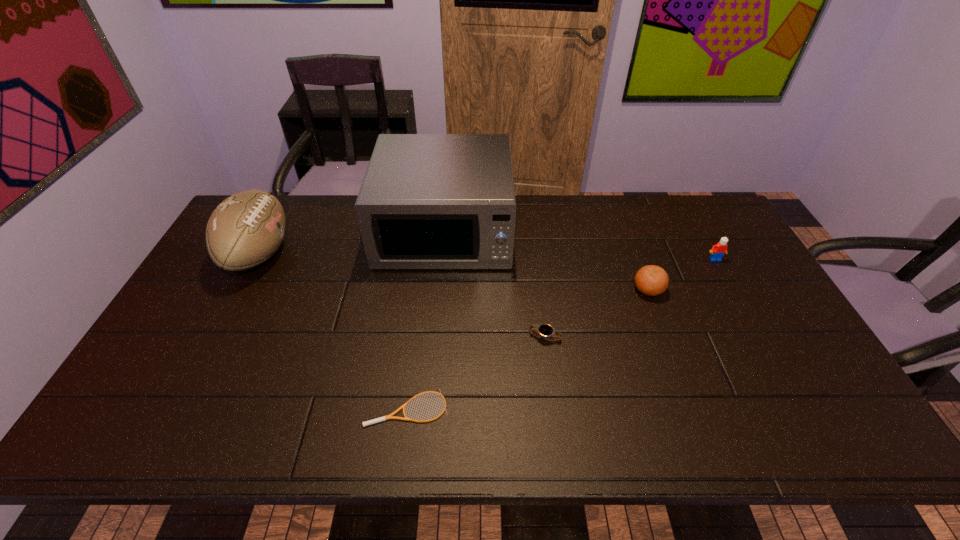
Identify the location of free spot that satisfies the following two spatial constraints: 1. on the laces of the football (American); 2. on the left side of the tennis racket. 178,408.

The width and height of the screenshot is (960, 540). What are the coordinates of `vacant position in the image that satisfies the following two spatial constraints: 1. on the laces of the nearest object; 2. on the right side of the second tallest object` in the screenshot? It's located at (178, 408).

At what (x,y) coordinates should I click in order to perform the action: click on free space that satisfies the following two spatial constraints: 1. with the door open on the microwave oven; 2. on the left side of the fourth object from left to right. Please return your answer as a coordinate pair (x, y). The width and height of the screenshot is (960, 540). Looking at the image, I should click on (435, 337).

In order to click on free space that satisfies the following two spatial constraints: 1. with the door open on the microwave oven; 2. on the right side of the clementine in this screenshot , I will do `click(439, 289)`.

Identify the location of vacant space that satisfies the following two spatial constraints: 1. on the laces of the fourth object from left to right; 2. on the left side of the second tallest object. This screenshot has width=960, height=540. (216, 337).

In order to click on free location that satisfies the following two spatial constraints: 1. with the door open on the tallest object; 2. on the right side of the second object from right to left in this screenshot , I will do `click(439, 289)`.